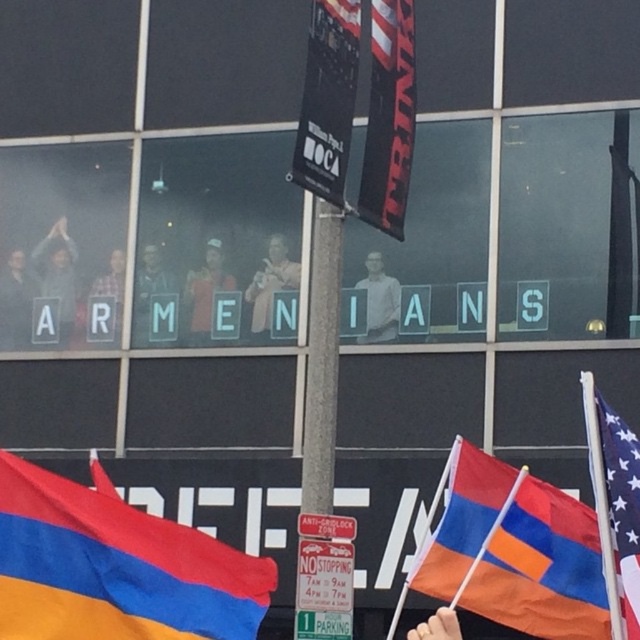
Is point (380, 337) farther from camera compared to point (90, 326)?

No.

Who is taller, matte gray shirt at center or matte black shirt at center?

With more height is matte gray shirt at center.

Between point (371, 300) and point (120, 284), which one is positioned behind?

Positioned behind is point (120, 284).

Identify the location of matte gray shirt at center. The image size is (640, 640). (380, 300).

Which of these two, orange fabric flag at lower right or light brown leather jacket at center, stands shorter?

With less height is light brown leather jacket at center.

Is point (477, 592) positioned before point (252, 298)?

Yes, it is.

Identify the location of orange fabric flag at lower right. (516, 552).

Locate an element on the screen. Image resolution: width=640 pixels, height=640 pixels. orange fabric flag at lower right is located at coordinates (516, 552).

Does orange fabric flag at lower right lie behind american flag at right?

Yes, orange fabric flag at lower right is behind american flag at right.

Does point (602, 577) lie behind point (636, 552)?

That is True.

The height and width of the screenshot is (640, 640). In order to click on orange fabric flag at lower right in this screenshot , I will do `click(516, 552)`.